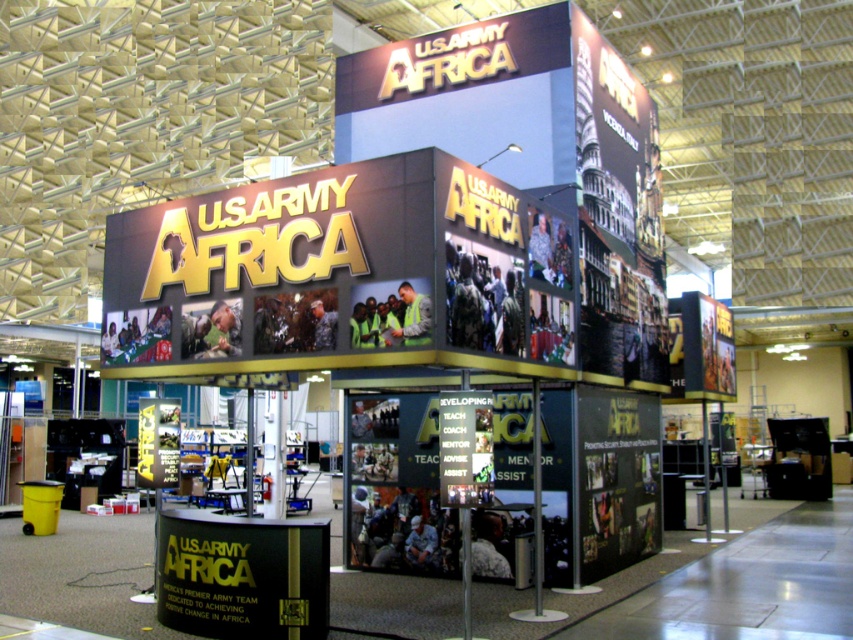
Does matte gold sign at center have a greater height compared to black matte sign at center?

Yes.

Does matte gold sign at center have a smaller size compared to black matte sign at center?

Incorrect, matte gold sign at center is not smaller in size than black matte sign at center.

Is point (137, 296) closer to viewer compared to point (177, 602)?

No, (137, 296) is further to viewer.

Locate an element on the screen. Image resolution: width=853 pixels, height=640 pixels. matte gold sign at center is located at coordinates (339, 269).